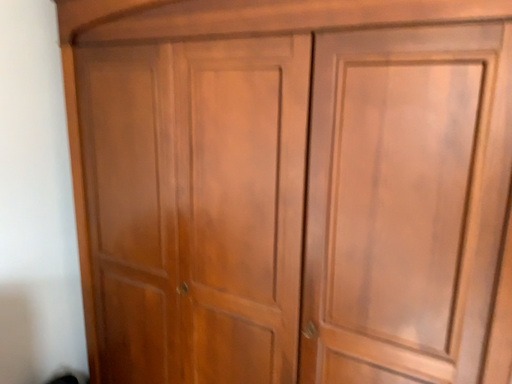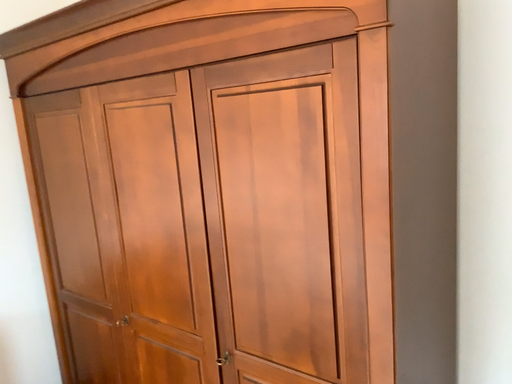
Question: How did the camera likely rotate when shooting the video?

Choices:
 (A) rotated right
 (B) rotated left

Answer: (B)